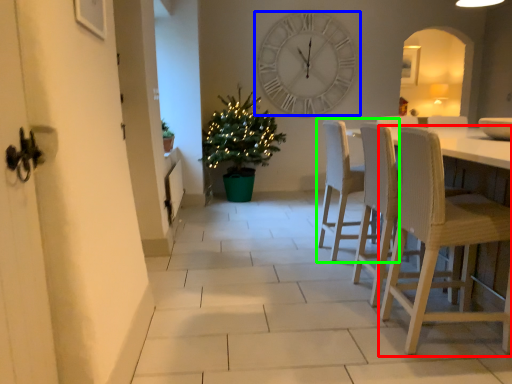
Question: Which object is positioned farthest from chair (highlighted by a red box)? Select from wall clock (highlighted by a blue box) and chair (highlighted by a green box).

Choices:
 (A) wall clock
 (B) chair

Answer: (A)